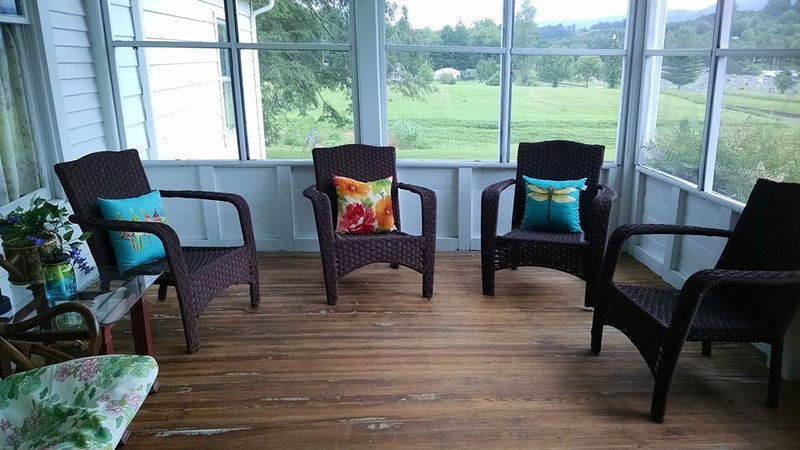
Find the location of a particular element. The image size is (800, 450). woodpane is located at coordinates (366, 39).